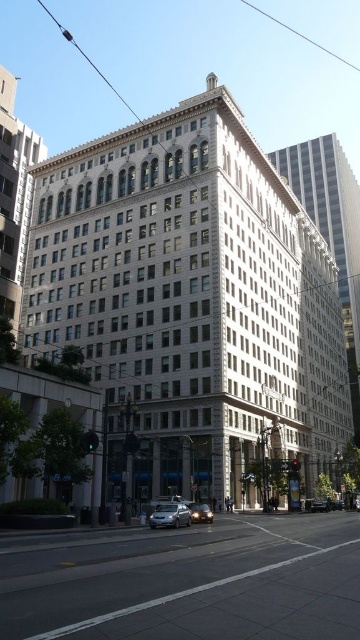
Can you confirm if satin silver sedan at lower center is thinner than shiny silver sedan at center?

Incorrect, satin silver sedan at lower center's width is not less than shiny silver sedan at center's.

Looking at this image, is satin silver sedan at lower center positioned at the back of shiny silver sedan at center?

No, it is not.

Is point (168, 515) positioned in front of point (326, 508)?

Yes, point (168, 515) is closer to viewer.

What are the coordinates of `satin silver sedan at lower center` in the screenshot? It's located at (169, 515).

Does point (204, 516) come closer to viewer compared to point (325, 506)?

That is True.

Does point (194, 516) come farther from viewer compared to point (324, 502)?

No, it is in front of (324, 502).

Locate an element on the screen. This screenshot has width=360, height=640. shiny silver sedan at lower center is located at coordinates (200, 513).

Between satin silver sedan at lower center and shiny silver sedan at lower center, which one is positioned higher?

satin silver sedan at lower center is higher up.

Between point (177, 509) and point (212, 516), which one is positioned in front?

Point (177, 509) is in front.

Between point (186, 509) and point (206, 516), which one is positioned in front?

Point (186, 509)

At what (x,y) coordinates should I click in order to perform the action: click on satin silver sedan at lower center. Please return your answer as a coordinate pair (x, y). The image size is (360, 640). Looking at the image, I should click on (169, 515).